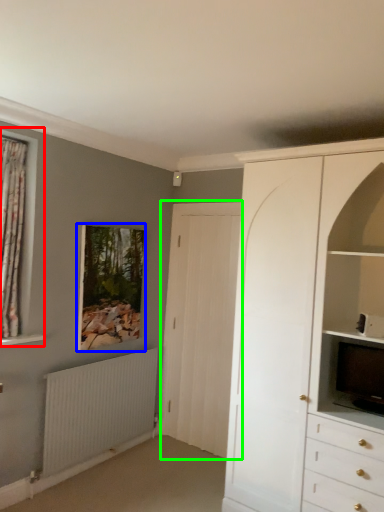
Question: Estimate the real-world distances between objects in this image. Which object is closer to window (highlighted by a red box), picture frame (highlighted by a blue box) or door (highlighted by a green box)?

Choices:
 (A) picture frame
 (B) door

Answer: (A)